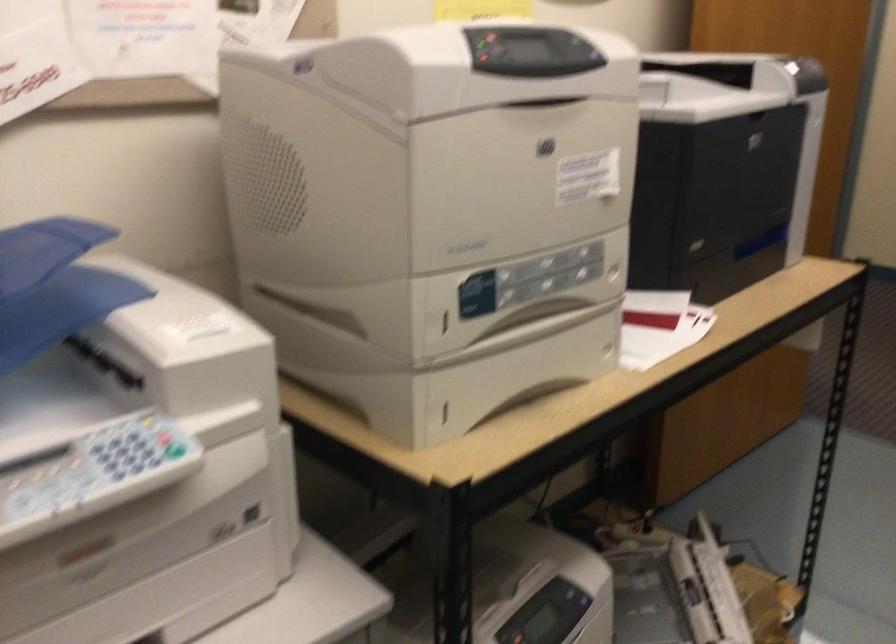
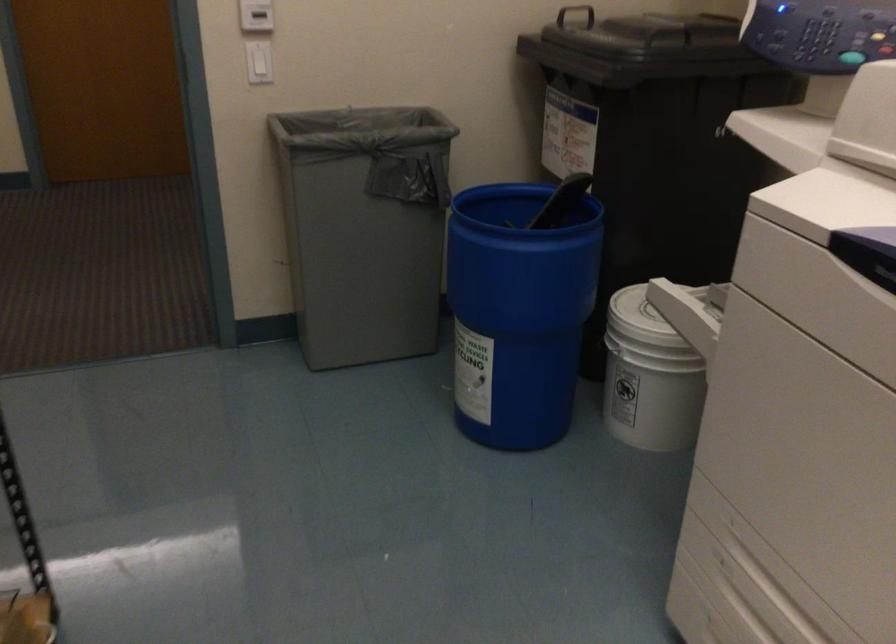
Question: The first image is from the beginning of the video and the second image is from the end. How did the camera likely rotate when shooting the video?

Choices:
 (A) Left
 (B) Right
 (C) Up
 (D) Down

Answer: (B)